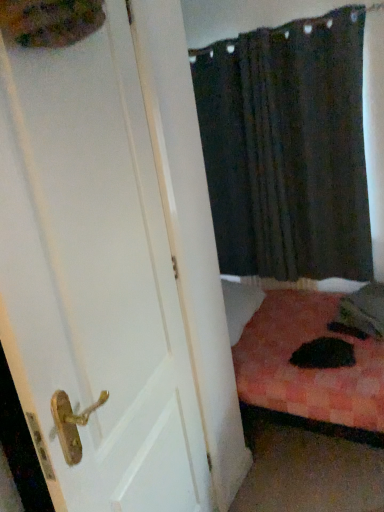
Question: From the image's perspective, would you say black fabric curtain at upper right is positioned over white wooden door at left?

Choices:
 (A) yes
 (B) no

Answer: (A)

Question: From the image's perspective, would you say black fabric curtain at upper right is shown under white wooden door at left?

Choices:
 (A) yes
 (B) no

Answer: (B)

Question: Can you confirm if black fabric curtain at upper right is thinner than white wooden door at left?

Choices:
 (A) no
 (B) yes

Answer: (A)

Question: Is black fabric curtain at upper right facing towards white wooden door at left?

Choices:
 (A) yes
 (B) no

Answer: (A)

Question: Is black fabric curtain at upper right positioned behind white wooden door at left?

Choices:
 (A) no
 (B) yes

Answer: (B)

Question: Considering the relative sizes of black fabric curtain at upper right and white wooden door at left in the image provided, is black fabric curtain at upper right bigger than white wooden door at left?

Choices:
 (A) yes
 (B) no

Answer: (A)

Question: Is white wooden door at left smaller than black fabric curtain at upper right?

Choices:
 (A) yes
 (B) no

Answer: (A)

Question: Is white wooden door at left wider than black fabric curtain at upper right?

Choices:
 (A) yes
 (B) no

Answer: (B)

Question: Does white wooden door at left come behind black fabric curtain at upper right?

Choices:
 (A) yes
 (B) no

Answer: (B)

Question: Can you confirm if white wooden door at left is positioned to the left of black fabric curtain at upper right?

Choices:
 (A) yes
 (B) no

Answer: (A)

Question: From the image's perspective, would you say white wooden door at left is positioned over black fabric curtain at upper right?

Choices:
 (A) no
 (B) yes

Answer: (A)

Question: Does white wooden door at left have a larger size compared to black fabric curtain at upper right?

Choices:
 (A) yes
 (B) no

Answer: (B)

Question: Is white wooden door at left situated inside black fabric curtain at upper right or outside?

Choices:
 (A) outside
 (B) inside

Answer: (A)